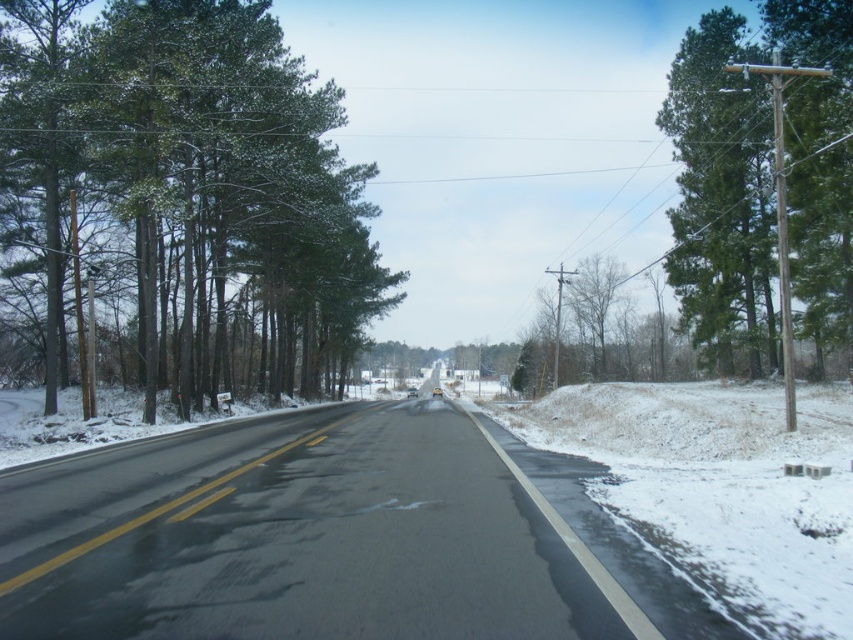
Question: Observing the image, what is the correct spatial positioning of black asphalt road at center in reference to green matte tree at right?

Choices:
 (A) below
 (B) above

Answer: (A)

Question: Which object appears farthest from the camera in this image?

Choices:
 (A) black asphalt road at center
 (B) green matte tree at right

Answer: (B)

Question: Among these points, which one is nearest to the camera?

Choices:
 (A) (265, 173)
 (B) (721, 262)

Answer: (A)

Question: From the image, what is the correct spatial relationship of black asphalt road at center in relation to green matte tree at right?

Choices:
 (A) right
 (B) left

Answer: (B)

Question: Is black asphalt road at center wider than green matte tree at right?

Choices:
 (A) no
 (B) yes

Answer: (A)

Question: Considering the real-world distances, which object is farthest from the green matte trees at left?

Choices:
 (A) black asphalt road at center
 (B) green matte tree at right

Answer: (B)